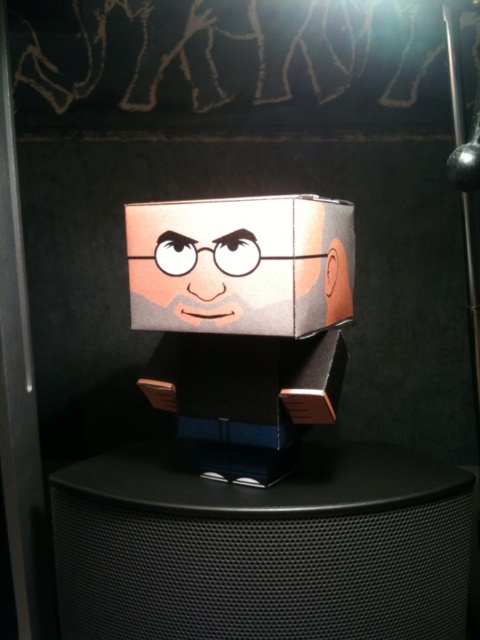
From the picture: Is matte cardboard box at center taller than matte paper face at center?

Correct, matte cardboard box at center is much taller as matte paper face at center.

Does point (312, 262) lie in front of point (219, 241)?

No, it is not.

Find the location of a particular element. matte cardboard box at center is located at coordinates (240, 264).

The image size is (480, 640). Describe the element at coordinates (263, 547) in the screenshot. I see `black mesh speaker at center` at that location.

Locate an element on the screen. The height and width of the screenshot is (640, 480). black mesh speaker at center is located at coordinates (263, 547).

Between point (93, 573) and point (160, 300), which one is positioned behind?

Positioned behind is point (93, 573).

Between black mesh speaker at center and matte cardboard box at center, which one has more height?

black mesh speaker at center is taller.

The height and width of the screenshot is (640, 480). In order to click on black mesh speaker at center in this screenshot , I will do `click(263, 547)`.